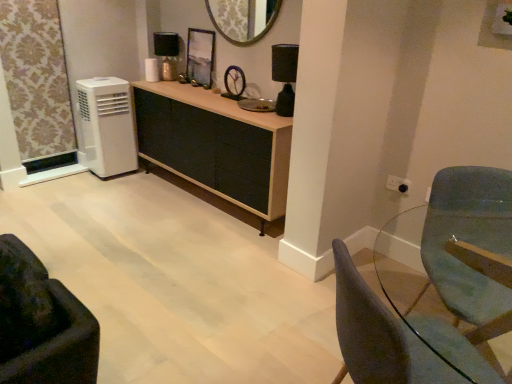
The image size is (512, 384). In order to click on vacant space in gold textured mirror at upper center (from a real-world perspective) in this screenshot , I will do `click(244, 95)`.